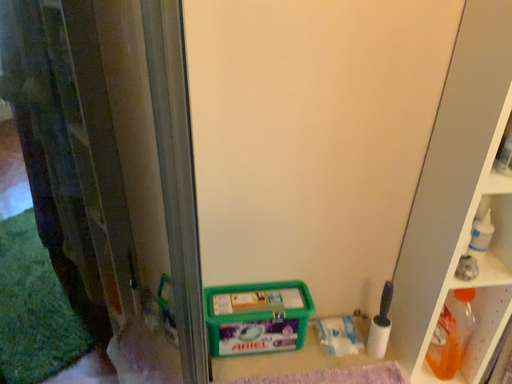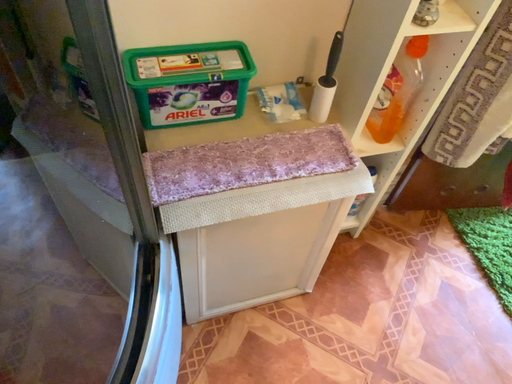
Question: How did the camera likely rotate when shooting the video?

Choices:
 (A) rotated upward
 (B) rotated downward

Answer: (B)